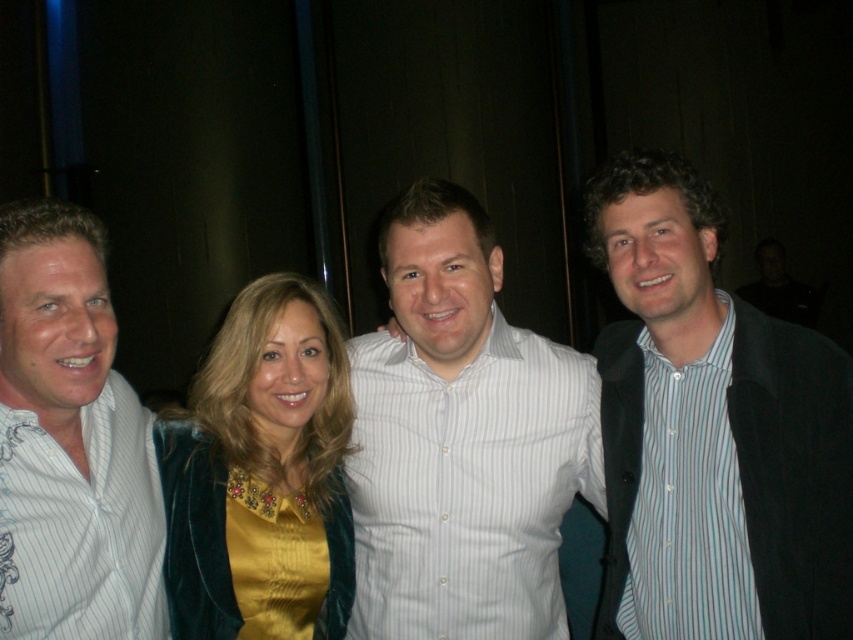
Question: Based on their relative distances, which object is nearer to the velvet/golden-yellow blouse at center?

Choices:
 (A) white striped shirt at left
 (B) striped cotton shirt at center

Answer: (A)

Question: Can you confirm if white striped shirt at left is wider than velvet/golden-yellow blouse at center?

Choices:
 (A) no
 (B) yes

Answer: (A)

Question: Which point is closer to the camera taking this photo?

Choices:
 (A) (10, 353)
 (B) (167, 422)
 (C) (519, 337)
 (D) (791, 340)

Answer: (A)

Question: Can you confirm if striped cotton shirt at center is wider than velvet/golden-yellow blouse at center?

Choices:
 (A) yes
 (B) no

Answer: (B)

Question: Estimate the real-world distances between objects in this image. Which object is farther from the velvet/golden-yellow blouse at center?

Choices:
 (A) striped cotton shirt at center
 (B) white striped shirt at center
 (C) white striped shirt at left

Answer: (A)

Question: Can you confirm if striped cotton shirt at center is positioned below white striped shirt at center?

Choices:
 (A) yes
 (B) no

Answer: (B)